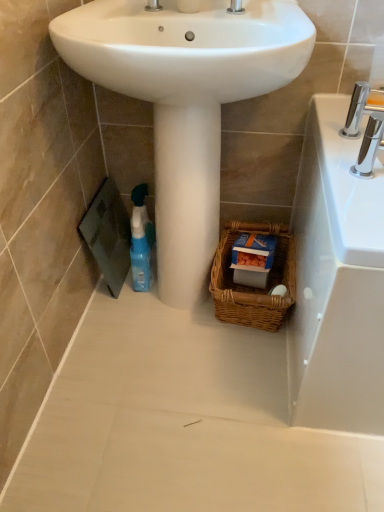
Question: From their relative heights in the image, would you say blue plastic spray bottle at lower left is taller or shorter than white smooth pedestal at center?

Choices:
 (A) tall
 (B) short

Answer: (B)

Question: Considering the positions of blue plastic spray bottle at lower left and white smooth pedestal at center in the image, is blue plastic spray bottle at lower left wider or thinner than white smooth pedestal at center?

Choices:
 (A) wide
 (B) thin

Answer: (B)

Question: Which object is positioned closest to the white glossy sink at center?

Choices:
 (A) blue plastic spray bottle at lower left
 (B) woven brown basket at lower center
 (C) chrome metallic faucet at upper right
 (D) white smooth pedestal at center

Answer: (D)

Question: Which is farther from the chrome metallic faucet at upper right?

Choices:
 (A) blue plastic spray bottle at lower left
 (B) white smooth pedestal at center
 (C) woven brown basket at lower center
 (D) white glossy sink at center

Answer: (A)